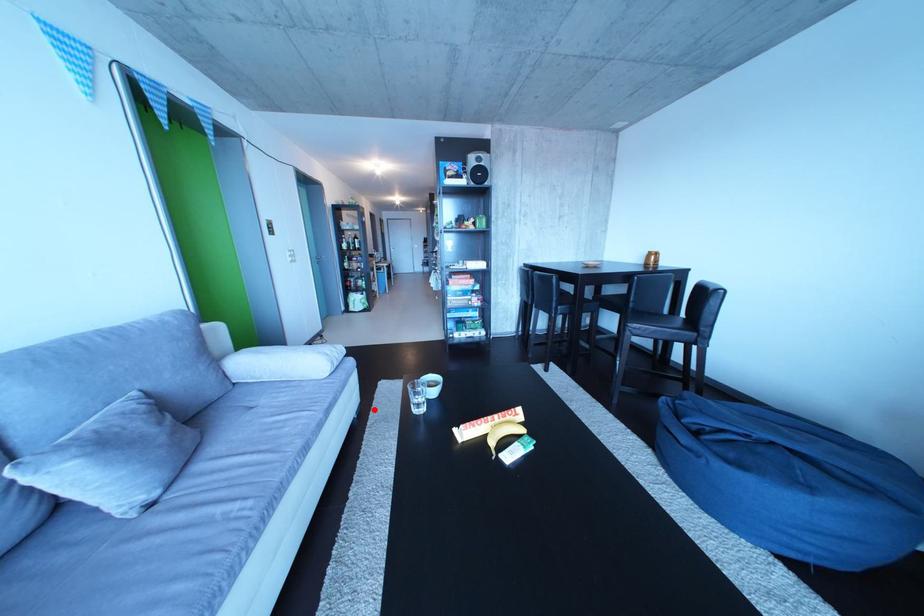
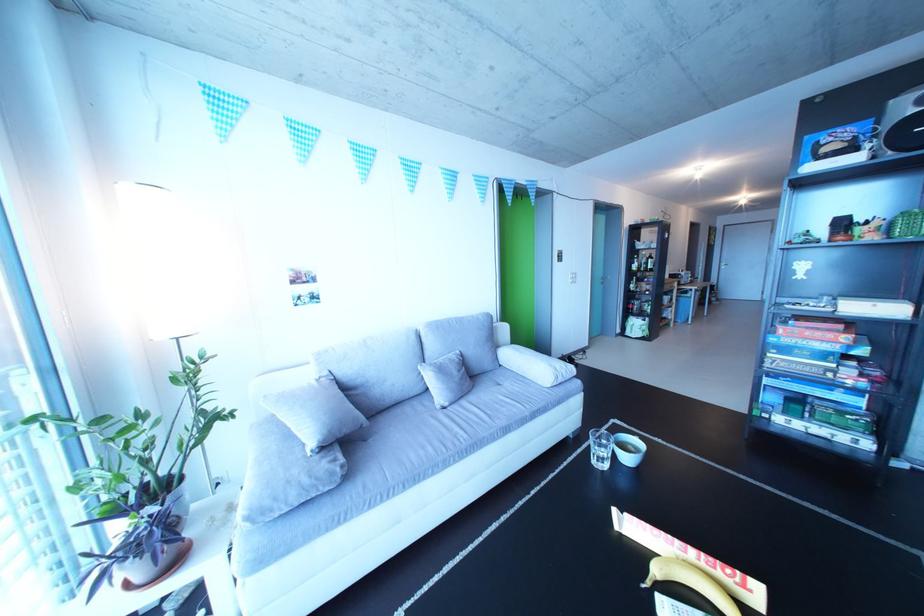
Question: I am providing you with two images of the same scene from different viewpoints. Image1 has a red point marked. In image2, the corresponding 3D location appears at what relative position? Reply with the corresponding letter.

Choices:
 (A) Closer
 (B) Farther

Answer: (A)